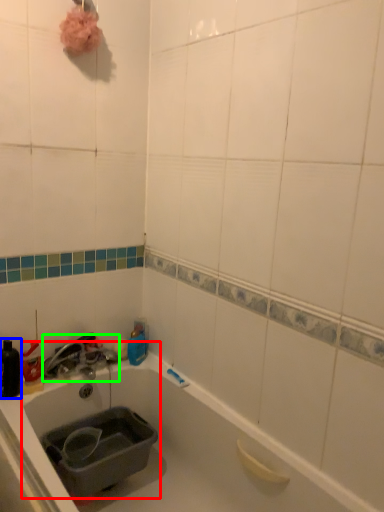
Question: Which object is the closest to the sink (highlighted by a red box)? Choose among these: bottle (highlighted by a blue box) or faucet (highlighted by a green box).

Choices:
 (A) bottle
 (B) faucet

Answer: (B)